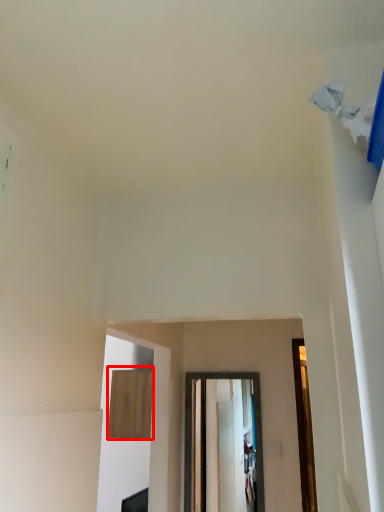
Question: From the image's perspective, considering the relative positions of plywood (annotated by the red box) and glass door in the image provided, where is plywood (annotated by the red box) located with respect to the staircase?

Choices:
 (A) above
 (B) below

Answer: (A)